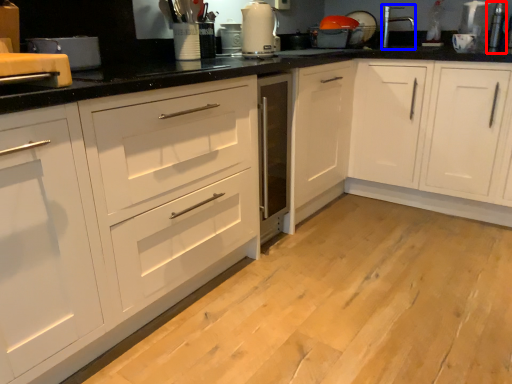
Question: Which of the following is the closest to the observer, appliance (highlighted by a red box) or faucet (highlighted by a blue box)?

Choices:
 (A) appliance
 (B) faucet

Answer: (A)